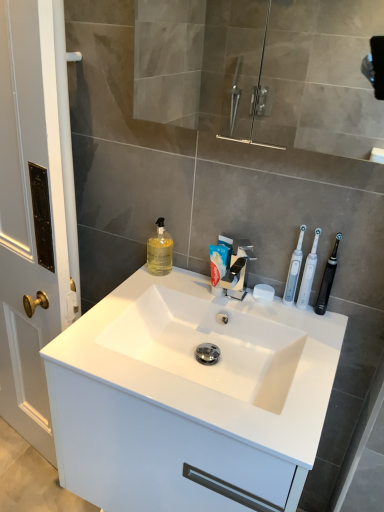
At what (x,y) coordinates should I click in order to perform the action: click on blank space to the left of white matte soap at center. Please return your answer as a coordinate pair (x, y). Looking at the image, I should click on (211, 293).